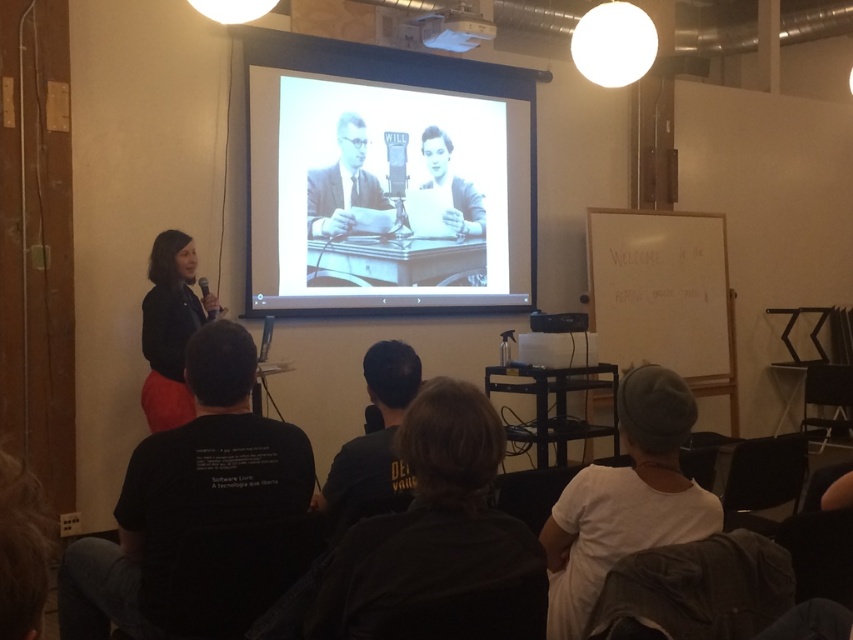
Question: Which point is farther to the camera?

Choices:
 (A) (358, 172)
 (B) (471, 35)
 (C) (164, 410)
 (D) (170, 483)

Answer: (B)

Question: Which point appears farthest from the camera in this image?

Choices:
 (A) (68, 632)
 (B) (569, 547)
 (C) (410, 349)

Answer: (C)

Question: Is matte black jacket at left positioned behind white plastic projector at upper center?

Choices:
 (A) yes
 (B) no

Answer: (B)

Question: Can you confirm if black cotton t-shirt at left is positioned below matte black jacket at left?

Choices:
 (A) no
 (B) yes

Answer: (B)

Question: Is black cotton t-shirt at left wider than black cotton shirt at center?

Choices:
 (A) yes
 (B) no

Answer: (A)

Question: Among these objects, which one is nearest to the camera?

Choices:
 (A) white glossy projection screen at center
 (B) matte black suit at center

Answer: (A)